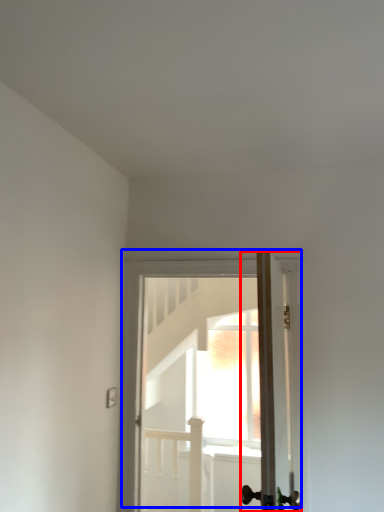
Question: Which point is closer to the camera, door (highlighted by a red box) or door (highlighted by a blue box)?

Choices:
 (A) door
 (B) door

Answer: (A)